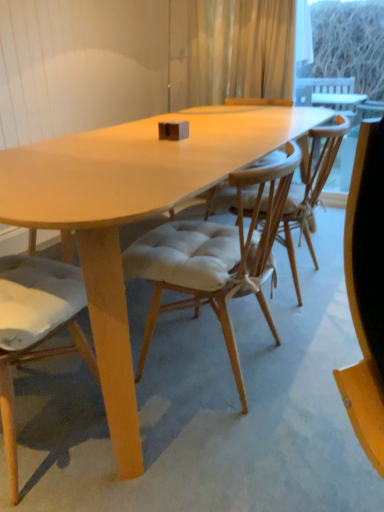
At what (x,y) coordinates should I click in order to perform the action: click on vacant area that lies to the right of light brown wood chair at center, the 2th chair viewed from the right. Please return your answer as a coordinate pair (x, y). The width and height of the screenshot is (384, 512). Looking at the image, I should click on [165, 452].